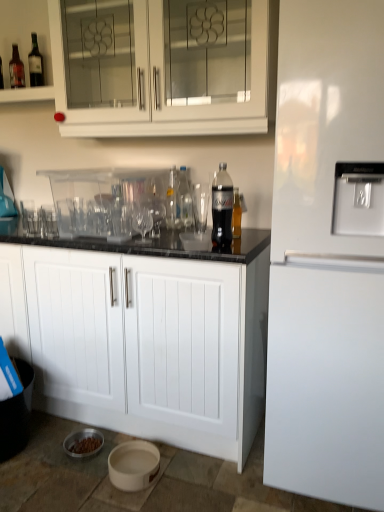
Question: Are clear glass bottle at center, which ranks as the third bottle in right-to-left order, and white glossy refrigerator at right located far from each other?

Choices:
 (A) yes
 (B) no

Answer: (B)

Question: Is clear glass bottle at center, the 1th bottle when ordered from left to right, next to white glossy refrigerator at right and touching it?

Choices:
 (A) yes
 (B) no

Answer: (B)

Question: Could you tell me if clear glass bottle at center, the 2th bottle from the front, is turned towards white glossy refrigerator at right?

Choices:
 (A) yes
 (B) no

Answer: (B)

Question: Does clear glass bottle at center, which ranks as the third bottle in right-to-left order, appear on the left side of white glossy refrigerator at right?

Choices:
 (A) yes
 (B) no

Answer: (A)

Question: Is clear glass bottle at center, the 2th bottle from the front, at the right side of white glossy refrigerator at right?

Choices:
 (A) no
 (B) yes

Answer: (A)

Question: From the image's perspective, is clear glass shot glass at center, the 3th shot glass viewed from the left, above or below white glossy refrigerator at right?

Choices:
 (A) below
 (B) above

Answer: (B)

Question: Choose the correct answer: Is clear glass shot glass at center, which is counted as the 1th shot glass, starting from the right, inside white glossy refrigerator at right or outside it?

Choices:
 (A) inside
 (B) outside

Answer: (B)

Question: Based on their positions, is clear glass shot glass at center, which is counted as the 1th shot glass, starting from the right, located to the left or right of white glossy refrigerator at right?

Choices:
 (A) right
 (B) left

Answer: (B)

Question: From a real-world perspective, is clear glass shot glass at center, which is counted as the 1th shot glass, starting from the right, above or below white glossy refrigerator at right?

Choices:
 (A) above
 (B) below

Answer: (A)

Question: From a real-world perspective, is clear plastic drinking straw at upper left, arranged as the 1th drinking straw when viewed from the top, positioned above or below clear glass bottle at center, the 2th bottle from the front?

Choices:
 (A) below
 (B) above

Answer: (B)

Question: Considering their positions, is clear plastic drinking straw at upper left, the 2th drinking straw when ordered from bottom to top, located in front of or behind clear glass bottle at center, the 2th bottle from the front?

Choices:
 (A) behind
 (B) front

Answer: (A)

Question: Is clear plastic drinking straw at upper left, which is counted as the second drinking straw, starting from the right, taller or shorter than clear glass bottle at center, the 2th bottle from the front?

Choices:
 (A) short
 (B) tall

Answer: (A)

Question: In terms of size, does clear plastic drinking straw at upper left, acting as the 2th drinking straw starting from the front, appear bigger or smaller than clear glass bottle at center, the 2th bottle from the front?

Choices:
 (A) big
 (B) small

Answer: (B)

Question: Is point (62, 124) closer or farther from the camera than point (54, 215)?

Choices:
 (A) closer
 (B) farther

Answer: (A)

Question: Would you say white glass cabinet at upper center, the second cabinetry in the bottom-to-top sequence, is to the left or to the right of transparent glass shot glass at center, arranged as the second shot glass when viewed from the right, in the picture?

Choices:
 (A) left
 (B) right

Answer: (B)